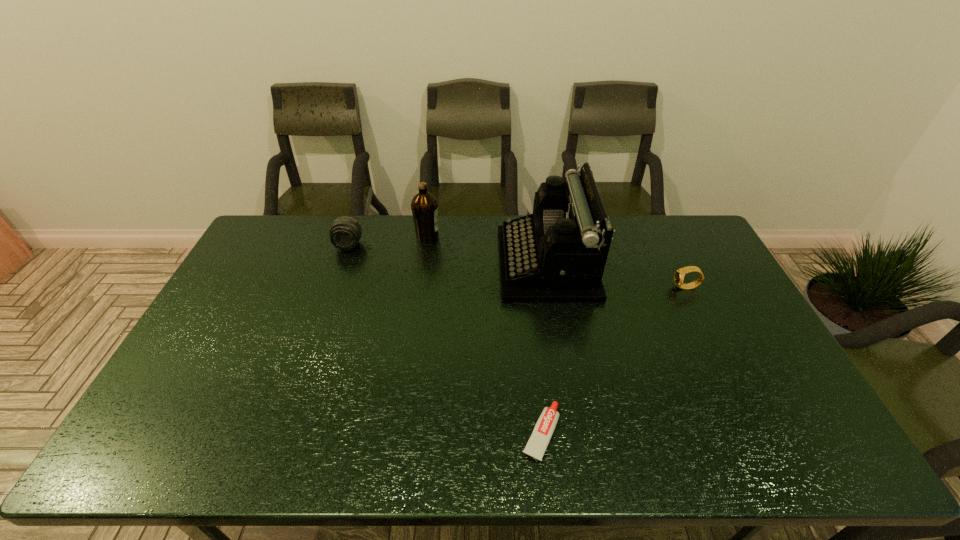
Find the location of a particular element. The width and height of the screenshot is (960, 540). free space located 0.120m on the typing side of the typewriter is located at coordinates click(465, 264).

Where is `vacant position located on the typing side of the typewriter`? This screenshot has width=960, height=540. vacant position located on the typing side of the typewriter is located at coordinates (384, 264).

Where is `vacant space located 0.200m on the label of the fourth shortest object`? vacant space located 0.200m on the label of the fourth shortest object is located at coordinates (493, 236).

Identify the location of blank space located at the front element of the third shortest object. The image size is (960, 540). (337, 278).

Where is `free point located 0.290m on the face of the watch`? Image resolution: width=960 pixels, height=540 pixels. free point located 0.290m on the face of the watch is located at coordinates (585, 288).

Identify the location of free space located on the face of the watch. (643, 288).

Locate an element on the screen. This screenshot has width=960, height=540. free spot located 0.240m on the face of the watch is located at coordinates (600, 288).

This screenshot has height=540, width=960. Identify the location of vacant space located 0.160m on the right of the shortest object. (627, 433).

In order to click on typewriter that is at the far edge in this screenshot , I will do `click(557, 254)`.

I want to click on olive oil at the far edge, so click(424, 206).